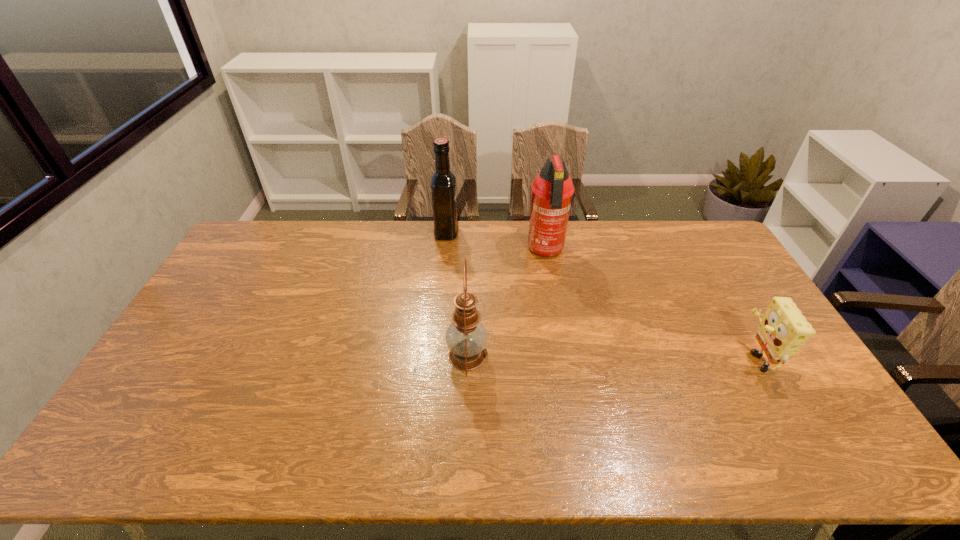
Where is `free spot between the liquor and the fire extinguisher`? free spot between the liquor and the fire extinguisher is located at coordinates (496, 242).

Choose which object is the second nearest neighbor to the second object from right to left. Please provide its 2D coordinates. Your answer should be formatted as a tuple, i.e. [(x, y)], where the tuple contains the x and y coordinates of a point satisfying the conditions above.

[(466, 337)]

Locate which object ranks second in proximity to the rightmost object. Please provide its 2D coordinates. Your answer should be formatted as a tuple, i.e. [(x, y)], where the tuple contains the x and y coordinates of a point satisfying the conditions above.

[(466, 337)]

Where is `vacant space that satisfies the following two spatial constraints: 1. on the back side of the oil lamp; 2. on the front-facing side of the liquor`? This screenshot has height=540, width=960. vacant space that satisfies the following two spatial constraints: 1. on the back side of the oil lamp; 2. on the front-facing side of the liquor is located at coordinates (470, 232).

This screenshot has width=960, height=540. I want to click on vacant space that satisfies the following two spatial constraints: 1. on the front-facing side of the liquor; 2. on the back side of the oil lamp, so click(x=435, y=355).